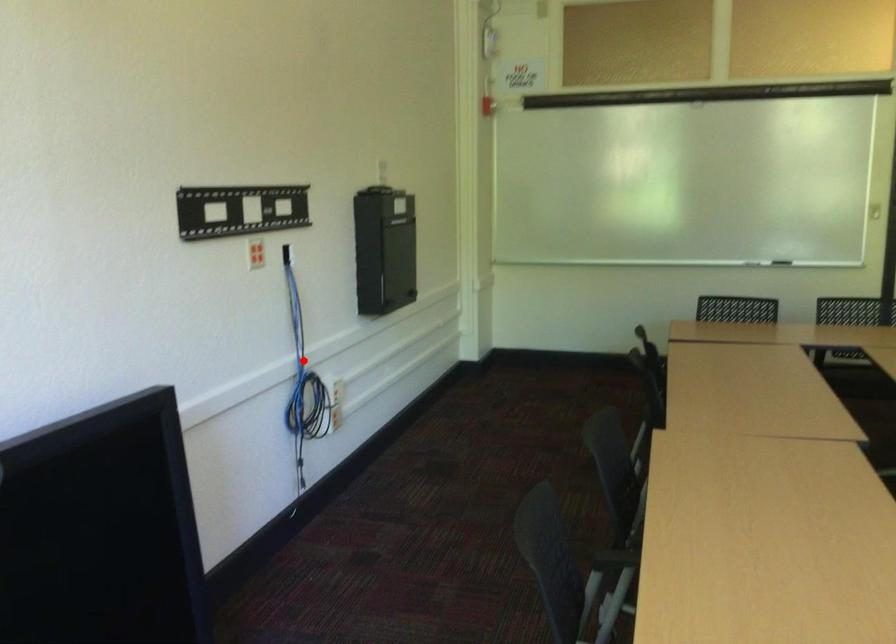
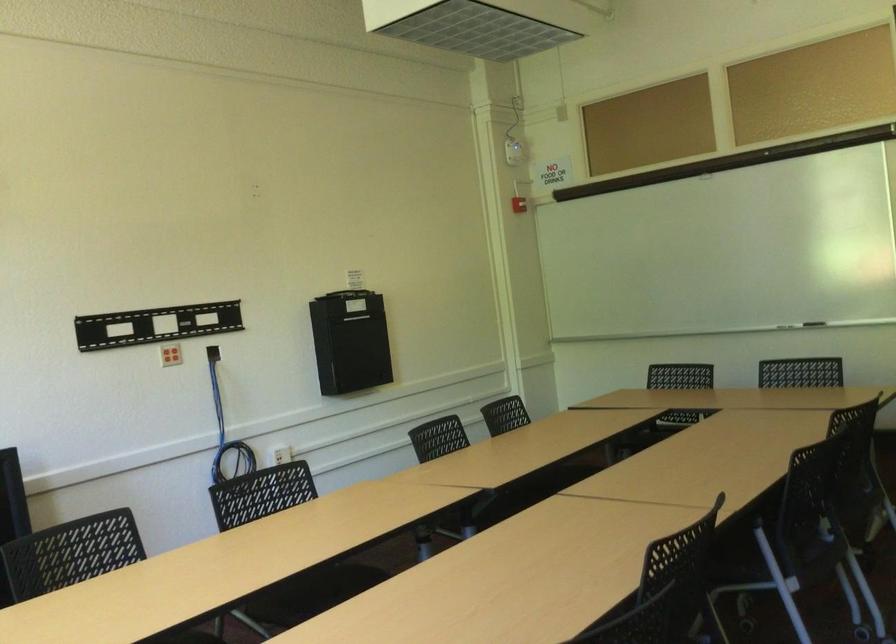
Question: A red point is marked in image1. In image2, is the corresponding 3D point closer to the camera or farther? Reply with the corresponding letter.

Choices:
 (A) The corresponding 3D point is closer.
 (B) The corresponding 3D point is farther.

Answer: (B)